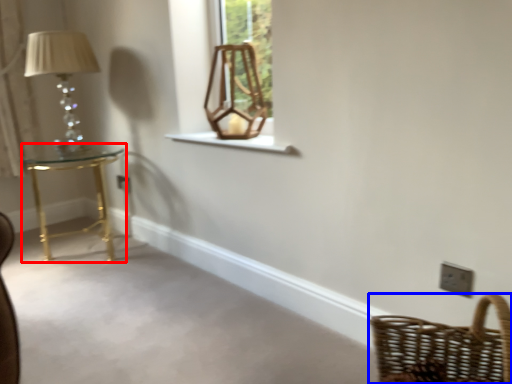
Question: Which of the following is the closest to the observer, table (highlighted by a red box) or basket (highlighted by a blue box)?

Choices:
 (A) table
 (B) basket

Answer: (B)